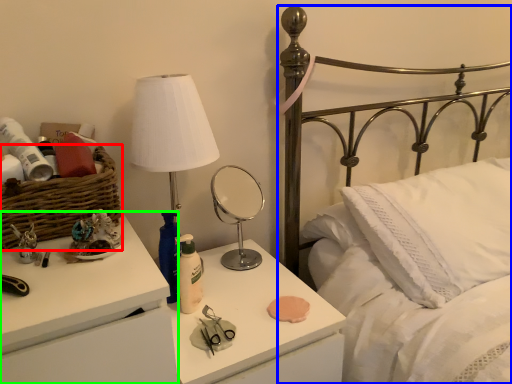
Question: Estimate the real-world distances between objects in this image. Which object is farther from basket (highlighted by a red box), bed (highlighted by a blue box) or nightstand (highlighted by a green box)?

Choices:
 (A) bed
 (B) nightstand

Answer: (A)